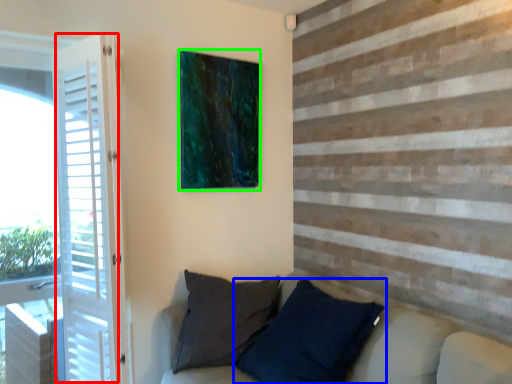
Question: Which is nearer to the screen door (highlighted by a red box)? pillow (highlighted by a blue box) or picture frame (highlighted by a green box).

Choices:
 (A) pillow
 (B) picture frame

Answer: (B)